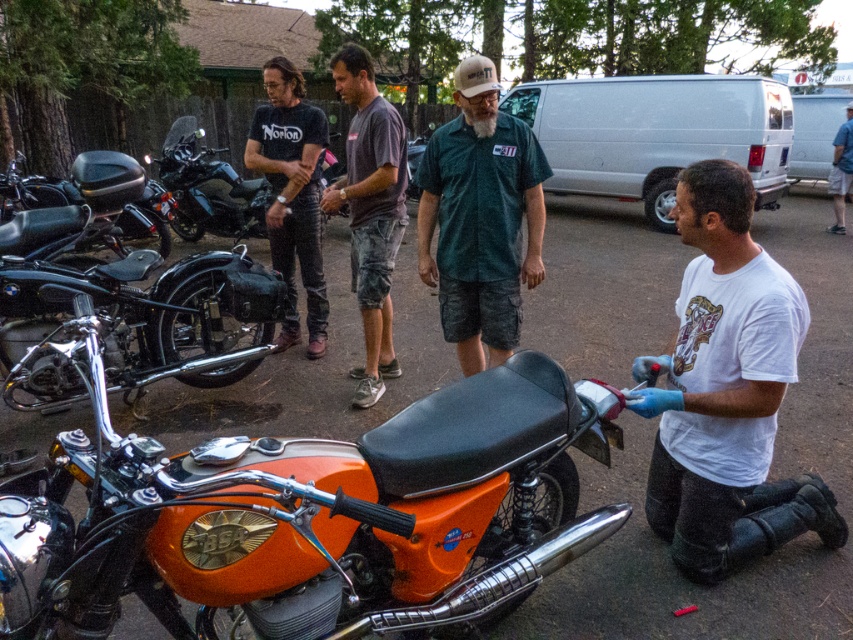
Question: Can you confirm if green camo shorts at center is thinner than blue denim shorts at lower right?

Choices:
 (A) no
 (B) yes

Answer: (A)

Question: In this image, where is white matte shirt at lower right located relative to green camo shorts at center?

Choices:
 (A) left
 (B) right

Answer: (B)

Question: Considering the real-world distances, which object is farthest from the green camo shorts at center?

Choices:
 (A) white matte shirt at lower right
 (B) dark gray cotton t-shirt at center
 (C) blue denim shorts at lower right
 (D) orange matte motorcycle at center

Answer: (C)

Question: Which object is the farthest from the matte black motorcycle at left?

Choices:
 (A) blue denim shorts at lower right
 (B) white matte shirt at lower right
 (C) orange matte motorcycle at center
 (D) white matte van at upper center

Answer: (A)

Question: Does orange matte motorcycle at center have a lesser width compared to matte black motorcycle at left?

Choices:
 (A) yes
 (B) no

Answer: (B)

Question: Which point is farther to the camera?

Choices:
 (A) black cotton t-shirt at upper left
 (B) matte black motorcycle at left

Answer: (B)